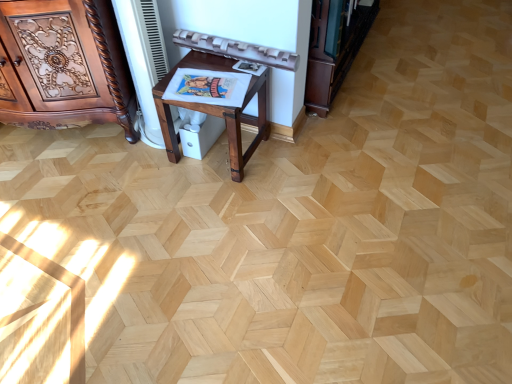
Question: From a real-world perspective, is polished wood cabinet at left over mahogany wood table at center?

Choices:
 (A) no
 (B) yes

Answer: (B)

Question: Is polished wood cabinet at left oriented towards mahogany wood table at center?

Choices:
 (A) yes
 (B) no

Answer: (B)

Question: Would you say polished wood cabinet at left is a long distance from mahogany wood table at center?

Choices:
 (A) no
 (B) yes

Answer: (A)

Question: Considering the relative positions of polished wood cabinet at left and mahogany wood table at center in the image provided, is polished wood cabinet at left to the left of mahogany wood table at center from the viewer's perspective?

Choices:
 (A) no
 (B) yes

Answer: (B)

Question: Considering the relative positions of polished wood cabinet at left and mahogany wood table at center in the image provided, is polished wood cabinet at left behind mahogany wood table at center?

Choices:
 (A) no
 (B) yes

Answer: (A)

Question: In the image, is mahogany wood table at center positioned in front of or behind polished wood cabinet at left?

Choices:
 (A) behind
 (B) front

Answer: (A)

Question: From the image's perspective, is mahogany wood table at center located above or below polished wood cabinet at left?

Choices:
 (A) above
 (B) below

Answer: (B)

Question: Considering the positions of mahogany wood table at center and polished wood cabinet at left in the image, is mahogany wood table at center taller or shorter than polished wood cabinet at left?

Choices:
 (A) short
 (B) tall

Answer: (A)

Question: Is mahogany wood table at center to the left or to the right of polished wood cabinet at left in the image?

Choices:
 (A) left
 (B) right

Answer: (B)

Question: In terms of width, does dark brown wood bookshelf at upper right look wider or thinner when compared to mahogany wood table at center?

Choices:
 (A) thin
 (B) wide

Answer: (A)

Question: Is point (358, 33) closer or farther from the camera than point (230, 163)?

Choices:
 (A) closer
 (B) farther

Answer: (B)

Question: Is dark brown wood bookshelf at upper right to the left or to the right of mahogany wood table at center in the image?

Choices:
 (A) right
 (B) left

Answer: (A)

Question: From a real-world perspective, is dark brown wood bookshelf at upper right positioned above or below mahogany wood table at center?

Choices:
 (A) above
 (B) below

Answer: (A)

Question: Is point pos(329,87) positioned closer to the camera than point pos(87,112)?

Choices:
 (A) farther
 (B) closer

Answer: (A)

Question: From a real-world perspective, is dark brown wood bookshelf at upper right positioned above or below polished wood cabinet at left?

Choices:
 (A) above
 (B) below

Answer: (B)